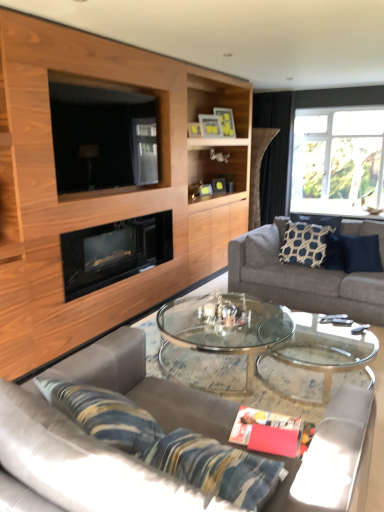
Question: From a real-world perspective, is clear glass window at upper right above or below wooden cabinet at upper left?

Choices:
 (A) below
 (B) above

Answer: (B)

Question: In terms of width, does clear glass window at upper right look wider or thinner when compared to wooden cabinet at upper left?

Choices:
 (A) wide
 (B) thin

Answer: (B)

Question: Which object is the closest to the matte yellow picture frame at upper center, marked as the first picture frame in a back-to-front arrangement?

Choices:
 (A) dark blue fabric pillow at right, the first pillow positioned from the right
 (B) matte gold picture frame at upper center, the third picture frame when ordered from back to front
 (C) wooden cabinet at upper left
 (D) wooden picture frame at upper center, which ranks as the 2th picture frame in front-to-back order
 (E) leather couch at center, which ranks as the first studio couch in front-to-back order

Answer: (D)

Question: Which of these objects is positioned closest to the gray fabric couch at right, which appears as the 2th studio couch when viewed from the left?

Choices:
 (A) navy blue textured pillow at right, which appears as the 2th pillow when viewed from the right
 (B) wooden cabinet at upper left
 (C) leather couch at center, marked as the 2th studio couch in a right-to-left arrangement
 (D) wooden picture frame at upper center, which ranks as the 2th picture frame in front-to-back order
 (E) black fabric curtain at upper right

Answer: (A)